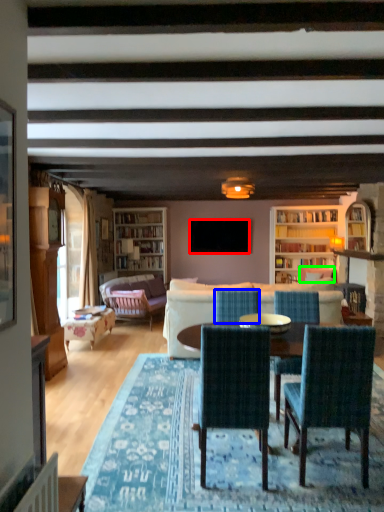
Question: Which is farther away from television (highlighted by a red box)? chair (highlighted by a blue box) or armchair (highlighted by a green box)?

Choices:
 (A) chair
 (B) armchair

Answer: (A)